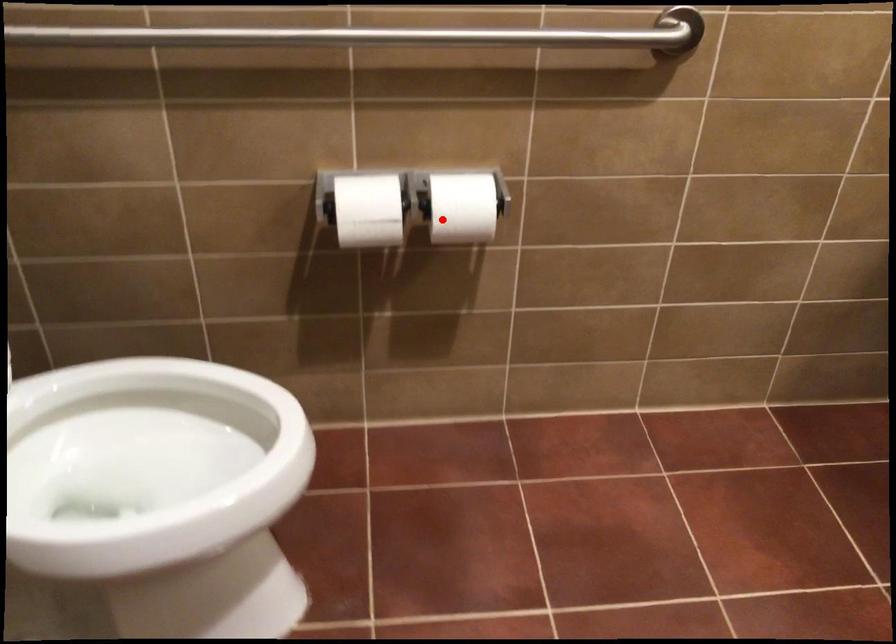
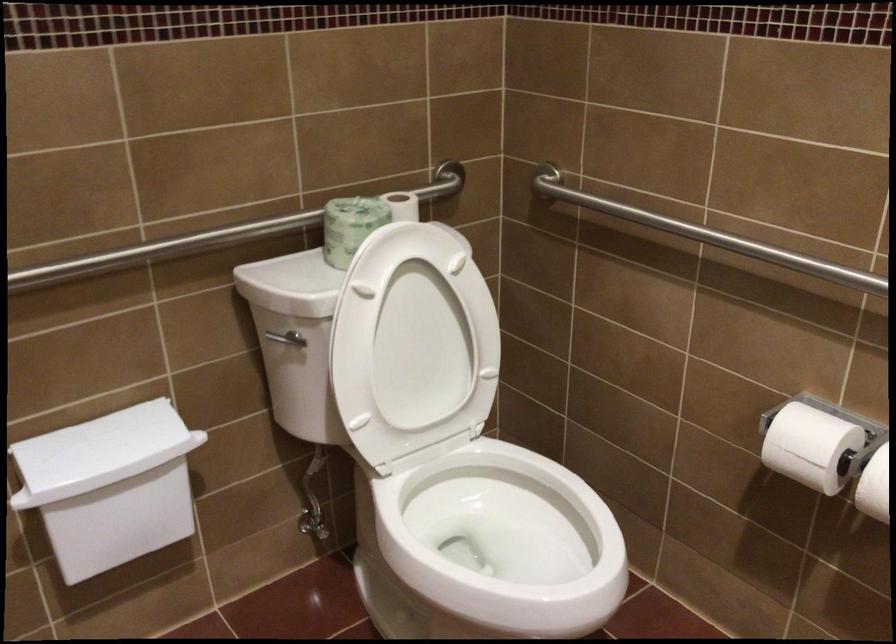
Question: A red point is marked in image1. In image2, is the corresponding 3D point closer to the camera or farther? Reply with the corresponding letter.

Choices:
 (A) The corresponding 3D point is closer.
 (B) The corresponding 3D point is farther.

Answer: (A)